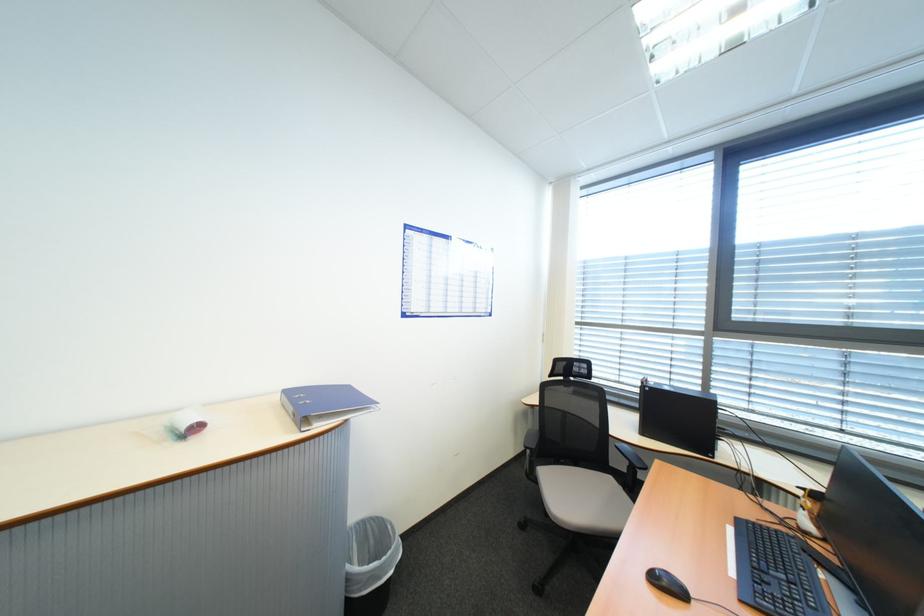
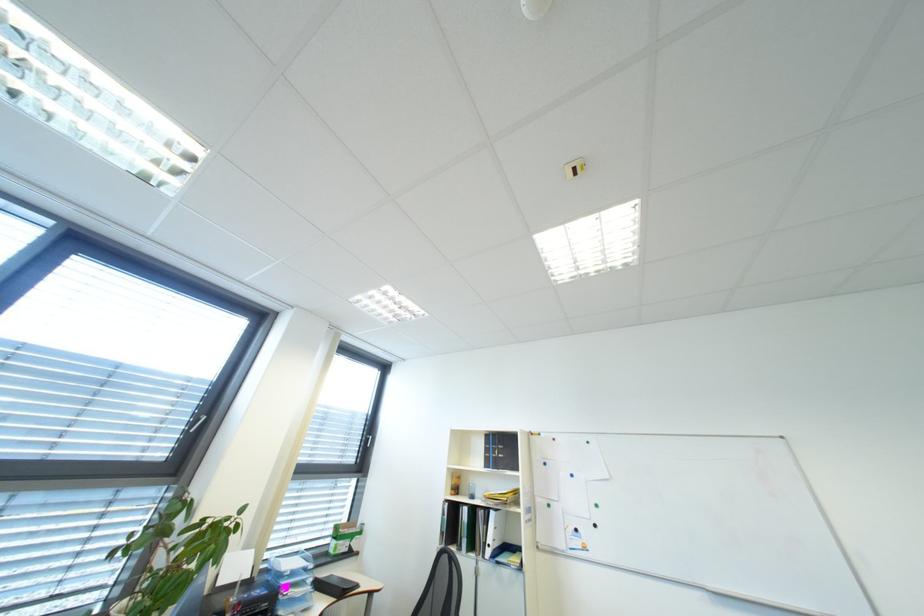
The first image is from the beginning of the video and the second image is from the end. How did the camera likely rotate when shooting the video?

The rotation direction of the camera is right-up.